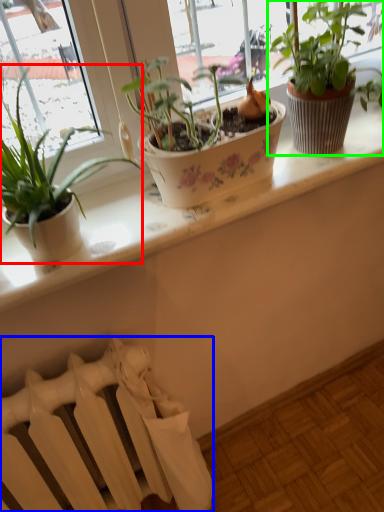
Question: Which is farther away from houseplant (highlighted by a red box)? radiator (highlighted by a blue box) or houseplant (highlighted by a green box)?

Choices:
 (A) radiator
 (B) houseplant

Answer: (A)